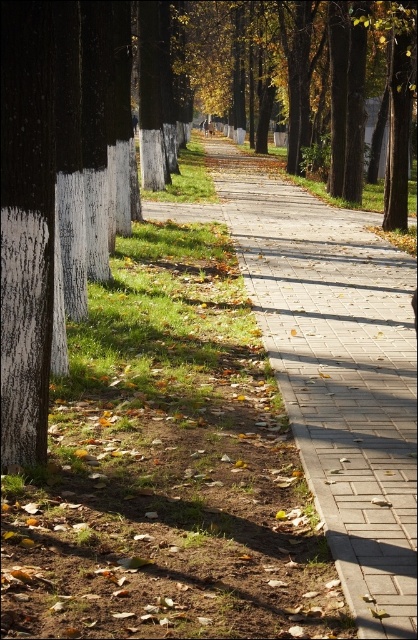
Question: Does paved concrete path at center lie in front of black bark tree at center?

Choices:
 (A) yes
 (B) no

Answer: (A)

Question: Can you confirm if paved concrete path at center is positioned above black bark tree at center?

Choices:
 (A) yes
 (B) no

Answer: (B)

Question: Among these objects, which one is nearest to the camera?

Choices:
 (A) paved concrete path at center
 (B) black bark tree at center

Answer: (A)

Question: Which point appears closest to the camera in this image?

Choices:
 (A) (35, 262)
 (B) (260, 275)

Answer: (A)

Question: Does paved concrete path at center come behind black bark tree at center?

Choices:
 (A) yes
 (B) no

Answer: (B)